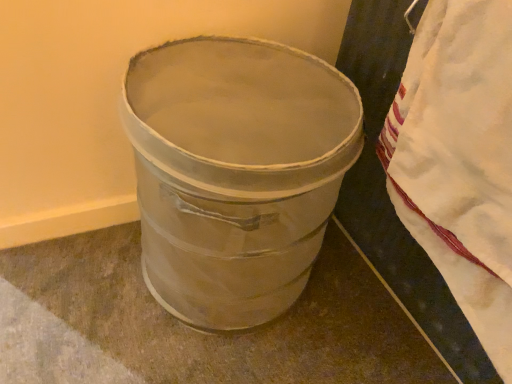
What do you see at coordinates (459, 159) in the screenshot? The image size is (512, 384). I see `white cotton blanket at right` at bounding box center [459, 159].

You are a GUI agent. You are given a task and a screenshot of the screen. Output one action in this format:
    pyautogui.click(x=<x>, y=<y>)
    Task: Click on the white cotton blanket at right
    This screenshot has height=384, width=512.
    Given the screenshot: What is the action you would take?
    pyautogui.click(x=459, y=159)

At what (x,y) coordinates should I click in order to perform the action: click on metallic silver trash can at center. Please return your answer as a coordinate pair (x, y). The height and width of the screenshot is (384, 512). Looking at the image, I should click on (236, 172).

The height and width of the screenshot is (384, 512). Describe the element at coordinates (236, 172) in the screenshot. I see `metallic silver trash can at center` at that location.

Measure the distance between point (342, 117) and camera.

Point (342, 117) and camera are 31.69 inches apart.

In order to face metallic silver trash can at center, should I rotate leftwards or rightwards?

Rotate left and turn 2.813 degrees.

I want to click on white cotton blanket at right, so click(459, 159).

Between metallic silver trash can at center and white cotton blanket at right, which one appears on the left side from the viewer's perspective?

metallic silver trash can at center is more to the left.

Considering the positions of objects metallic silver trash can at center and white cotton blanket at right in the image provided, who is behind, metallic silver trash can at center or white cotton blanket at right?

metallic silver trash can at center is behind.

Which is further, (224, 308) or (419, 53)?

The point (224, 308) is more distant.

From the image's perspective, is metallic silver trash can at center above or below white cotton blanket at right?

Based on their image positions, metallic silver trash can at center is located beneath white cotton blanket at right.

From a real-world perspective, who is located lower, metallic silver trash can at center or white cotton blanket at right?

metallic silver trash can at center, from a real-world perspective.

Which of these two, metallic silver trash can at center or white cotton blanket at right, is thinner?

With smaller width is white cotton blanket at right.

Can you confirm if metallic silver trash can at center is taller than white cotton blanket at right?

Yes, metallic silver trash can at center is taller than white cotton blanket at right.

Considering the relative sizes of metallic silver trash can at center and white cotton blanket at right in the image provided, is metallic silver trash can at center smaller than white cotton blanket at right?

Incorrect, metallic silver trash can at center is not smaller in size than white cotton blanket at right.

Is white cotton blanket at right a part of metallic silver trash can at center?

Definitely not — white cotton blanket at right is not inside metallic silver trash can at center.

Are metallic silver trash can at center and white cotton blanket at right making contact?

metallic silver trash can at center and white cotton blanket at right are not in contact.

Is metallic silver trash can at center turned away from white cotton blanket at right?

No, metallic silver trash can at center is not facing away from white cotton blanket at right.

How distant is metallic silver trash can at center from white cotton blanket at right?

A distance of 11.63 inches exists between metallic silver trash can at center and white cotton blanket at right.

This screenshot has height=384, width=512. I want to click on waste container that is below the white cotton blanket at right (from the image's perspective), so coord(236,172).

Between white cotton blanket at right and metallic silver trash can at center, which one appears on the left side from the viewer's perspective?

metallic silver trash can at center.

Considering the positions of objects white cotton blanket at right and metallic silver trash can at center in the image provided, who is behind, white cotton blanket at right or metallic silver trash can at center?

metallic silver trash can at center is behind.

Does point (493, 122) appear closer or farther from the camera than point (345, 153)?

Clearly, point (493, 122) is closer to the camera than point (345, 153).

From the image's perspective, between white cotton blanket at right and metallic silver trash can at center, which one is located above?

white cotton blanket at right, from the image's perspective.

From a real-world perspective, is white cotton blanket at right physically located above or below metallic silver trash can at center?

white cotton blanket at right is situated higher than metallic silver trash can at center in the real world.

Looking at this image, is white cotton blanket at right thinner than metallic silver trash can at center?

Correct, the width of white cotton blanket at right is less than that of metallic silver trash can at center.

Who is taller, white cotton blanket at right or metallic silver trash can at center?

metallic silver trash can at center.

Is white cotton blanket at right bigger than metallic silver trash can at center?

No.

Choose the correct answer: Is white cotton blanket at right inside metallic silver trash can at center or outside it?

white cotton blanket at right cannot be found inside metallic silver trash can at center.

Are white cotton blanket at right and metallic silver trash can at center far apart?

Actually, white cotton blanket at right and metallic silver trash can at center are a little close together.

Could you tell me if white cotton blanket at right is facing metallic silver trash can at center?

No, white cotton blanket at right does not turn towards metallic silver trash can at center.

How many degrees apart are the facing directions of white cotton blanket at right and metallic silver trash can at center?

There is a 88.6-degree angle between the facing directions of white cotton blanket at right and metallic silver trash can at center.

Find the location of `blanket that appears on the right of metallic silver trash can at center`. blanket that appears on the right of metallic silver trash can at center is located at coordinates (459, 159).

Locate an element on the screen. blanket that is in front of the metallic silver trash can at center is located at coordinates (459, 159).

Find the location of `waste container behind the white cotton blanket at right`. waste container behind the white cotton blanket at right is located at coordinates (236, 172).